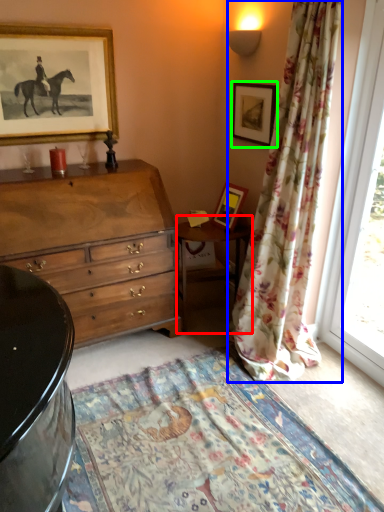
Question: Estimate the real-world distances between objects in this image. Which object is farther from table (highlighted by a red box), curtain (highlighted by a blue box) or picture frame (highlighted by a green box)?

Choices:
 (A) curtain
 (B) picture frame

Answer: (B)